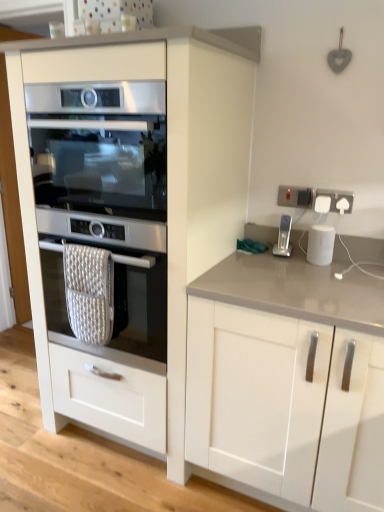
Question: Considering the relative sizes of white plastic socket at upper right, marked as the first electric outlet in a right-to-left arrangement, and satin silver oven at center, the second oven from the bottom, in the image provided, is white plastic socket at upper right, marked as the first electric outlet in a right-to-left arrangement, bigger than satin silver oven at center, the second oven from the bottom,?

Choices:
 (A) yes
 (B) no

Answer: (B)

Question: From the image's perspective, is white plastic socket at upper right, which is the 2th electric outlet from left to right, on top of satin silver oven at center, the second oven from the bottom?

Choices:
 (A) no
 (B) yes

Answer: (A)

Question: Is white plastic socket at upper right, which is the 2th electric outlet from left to right, facing towards satin silver oven at center, the first oven viewed from the top?

Choices:
 (A) no
 (B) yes

Answer: (A)

Question: From a real-world perspective, is white plastic socket at upper right, marked as the first electric outlet in a right-to-left arrangement, below satin silver oven at center, the second oven from the bottom?

Choices:
 (A) no
 (B) yes

Answer: (B)

Question: Does white plastic socket at upper right, which is the 2th electric outlet from left to right, have a greater width compared to satin silver oven at center, the first oven viewed from the top?

Choices:
 (A) no
 (B) yes

Answer: (A)

Question: Is satin silver oven at center, the first oven viewed from the top, inside the boundaries of white plastic socket at upper right, marked as the first electric outlet in a right-to-left arrangement, or outside?

Choices:
 (A) inside
 (B) outside

Answer: (B)

Question: From a real-world perspective, is satin silver oven at center, the first oven viewed from the top, above or below white plastic socket at upper right, marked as the first electric outlet in a right-to-left arrangement?

Choices:
 (A) above
 (B) below

Answer: (A)

Question: In the image, is satin silver oven at center, the second oven from the bottom, positioned in front of or behind white plastic socket at upper right, which is the 2th electric outlet from left to right?

Choices:
 (A) front
 (B) behind

Answer: (A)

Question: Is satin silver oven at center, the first oven viewed from the top, wider or thinner than white plastic socket at upper right, marked as the first electric outlet in a right-to-left arrangement?

Choices:
 (A) wide
 (B) thin

Answer: (A)

Question: Relative to satin silver oven at center, which is the first oven from bottom to top, is white plastic socket at upper right, the 1th electric outlet viewed from the left, in front or behind?

Choices:
 (A) front
 (B) behind

Answer: (B)

Question: From the image's perspective, is white plastic socket at upper right, which is the second electric outlet from right to left, above or below satin silver oven at center, which is the first oven from bottom to top?

Choices:
 (A) above
 (B) below

Answer: (A)

Question: Is white plastic socket at upper right, the 1th electric outlet viewed from the left, bigger or smaller than satin silver oven at center, which is the first oven from bottom to top?

Choices:
 (A) small
 (B) big

Answer: (A)

Question: Considering the positions of point coord(288,193) and point coord(135,261), is point coord(288,193) closer or farther from the camera than point coord(135,261)?

Choices:
 (A) farther
 (B) closer

Answer: (A)

Question: Looking at their shapes, would you say silver metallic stapler at right is wider or thinner than white glossy cabinet at left, positioned as the 2th cabinetry in right-to-left order?

Choices:
 (A) thin
 (B) wide

Answer: (A)

Question: Is silver metallic stapler at right taller or shorter than white glossy cabinet at left, which ranks as the first cabinetry in left-to-right order?

Choices:
 (A) tall
 (B) short

Answer: (B)